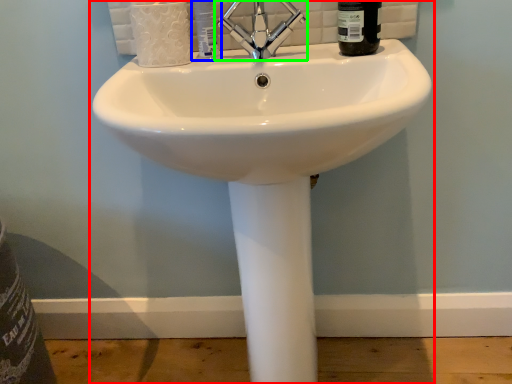
Question: Considering the real-world distances, which object is closest to sink (highlighted by a red box)? toiletry (highlighted by a blue box) or tap (highlighted by a green box).

Choices:
 (A) toiletry
 (B) tap

Answer: (B)